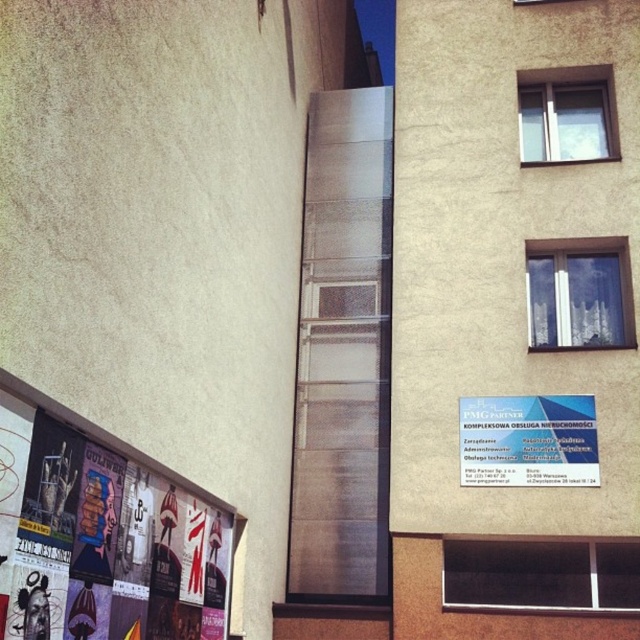
Question: Among these objects, which one is farthest from the camera?

Choices:
 (A) matte paper posters at lower left
 (B) white sheer curtain at upper right
 (C) transparent glass window at center

Answer: (B)

Question: Which object is farther from the camera taking this photo?

Choices:
 (A) white sheer curtain at upper right
 (B) white plastic sign at center right

Answer: (A)

Question: Based on their relative distances, which object is nearer to the transparent glass window at center?

Choices:
 (A) white sheer curtain at upper right
 (B) matte paper posters at lower left
 (C) clear glass window at upper right
 (D) white plastic sign at center right

Answer: (D)

Question: Can you confirm if matte paper posters at lower left is positioned to the left of transparent glass window at center?

Choices:
 (A) no
 (B) yes

Answer: (B)

Question: Is white plastic sign at center right above white sheer curtain at upper right?

Choices:
 (A) yes
 (B) no

Answer: (B)

Question: Can you confirm if white plastic sign at center right is bigger than white sheer curtain at upper right?

Choices:
 (A) yes
 (B) no

Answer: (B)